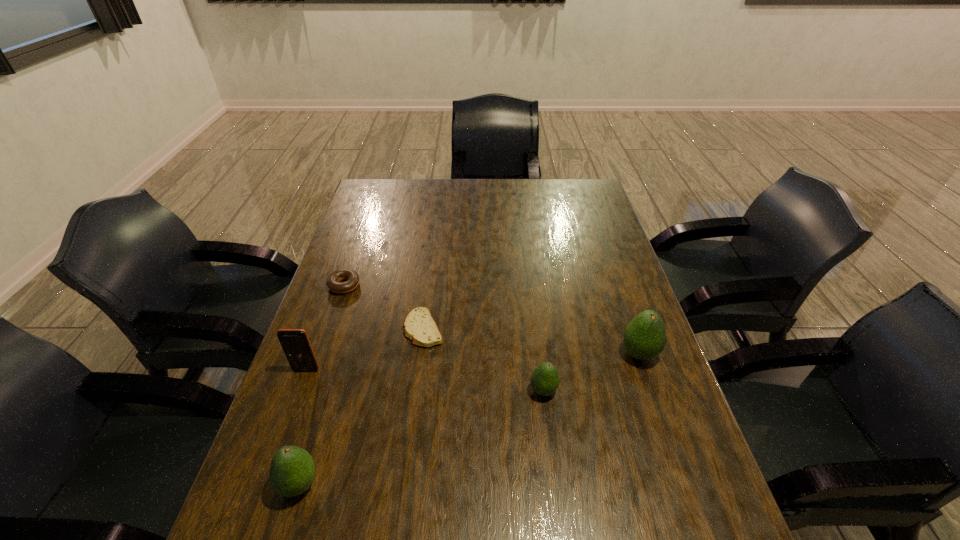
At what (x,y) coordinates should I click in order to perform the action: click on the fifth tallest object. Please return your answer as a coordinate pair (x, y). The height and width of the screenshot is (540, 960). Looking at the image, I should click on (333, 282).

In order to click on free space located on the right of the leftmost avocado in this screenshot , I will do `click(440, 484)`.

In order to click on vacant space located on the front of the second nearest object in this screenshot , I will do `click(548, 426)`.

This screenshot has height=540, width=960. In order to click on vacant area located on the left of the tallest avocado in this screenshot , I will do `click(507, 354)`.

Where is `vacant area located on the screen of the cellular telephone`? vacant area located on the screen of the cellular telephone is located at coordinates (288, 420).

This screenshot has width=960, height=540. I want to click on free point located 0.140m on the left of the pita bread, so click(x=351, y=329).

I want to click on vacant region located on the front of the farthest object, so click(x=317, y=365).

At what (x,y) coordinates should I click in order to perform the action: click on object located at the near edge. Please return your answer as a coordinate pair (x, y). This screenshot has width=960, height=540. Looking at the image, I should click on (292, 470).

Locate an element on the screen. This screenshot has height=540, width=960. avocado that is at the left edge is located at coordinates (292, 470).

I want to click on cellular telephone positioned at the left edge, so click(x=295, y=342).